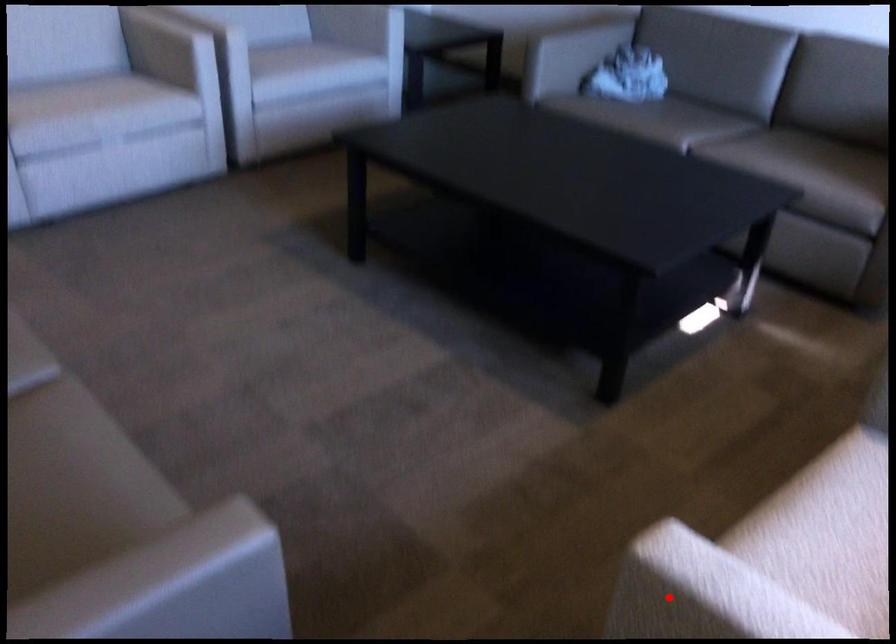
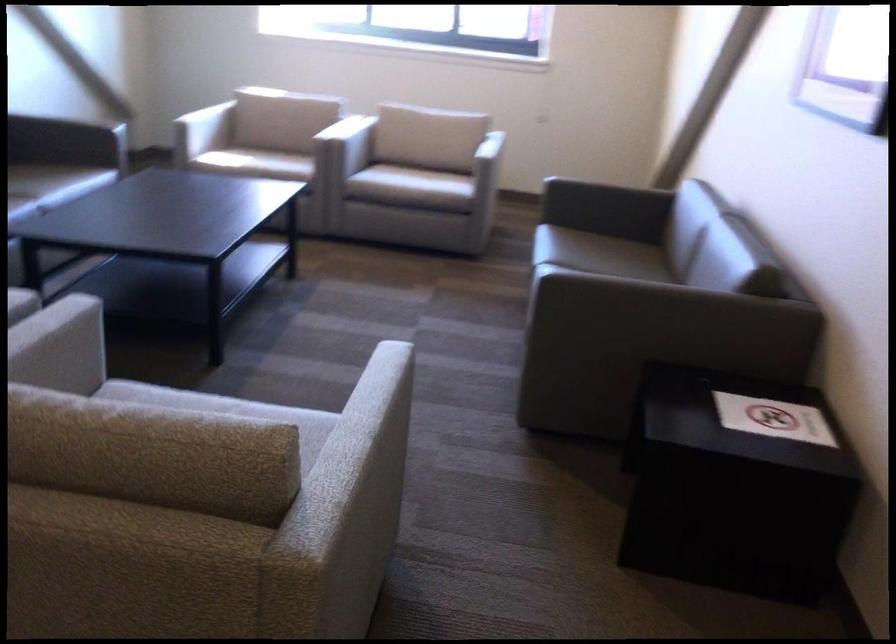
Question: I am providing you with two images of the same scene from different viewpoints. A red point is marked on the first image. Can you still see the location of the red point in image 2?

Choices:
 (A) Yes
 (B) No

Answer: (B)